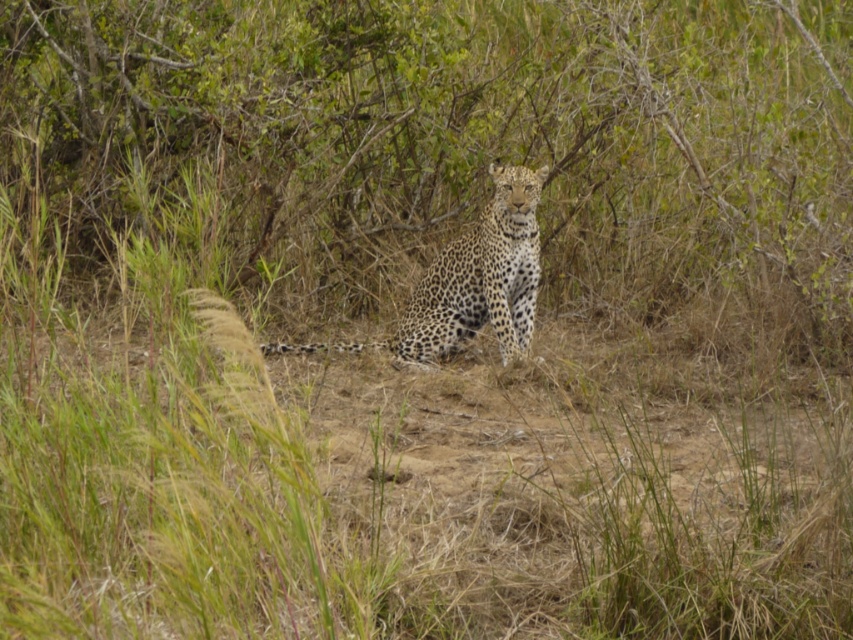
You are a photographer trying to capture the spotted fur leopard at center. You notice a green leafy bush at center in the background. Can you determine if the leopard will be more visible against the bush based on their sizes?

The green leafy bush at center is smaller than the spotted fur leopard at center, so the leopard will be more visible against the bush since it is larger and stands out more in the frame.

You are a wildlife photographer trying to capture a clear photo of the spotted fur leopard at center. However, there is a green leafy bush at center in the way. Can you adjust your position to get a better shot without moving the bush?

The green leafy bush at center is shorter than the spotted fur leopard at center, so you can lower your camera angle to position it below the bush and still capture the leopard.